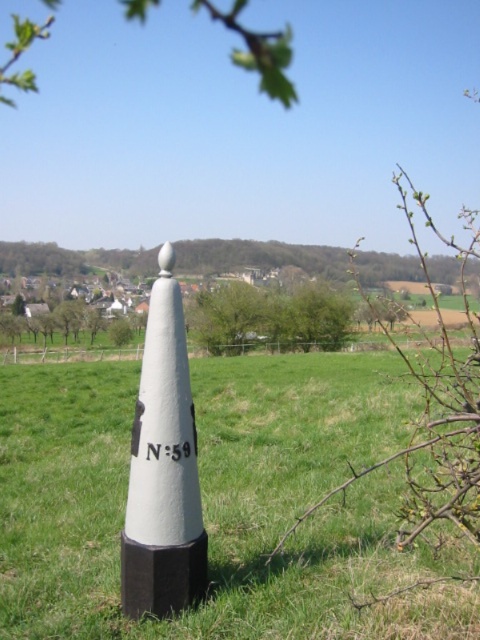
Does white painted concrete cone at center appear on the right side of green leafy branch at upper center?

Yes, white painted concrete cone at center is to the right of green leafy branch at upper center.

Does point (145, 340) lie in front of point (225, 26)?

Yes.

At what (x,y) coordinates should I click in order to perform the action: click on white painted concrete cone at center. Please return your answer as a coordinate pair (x, y). This screenshot has height=640, width=480. Looking at the image, I should click on (163, 468).

Is white matte cone at center bigger than white painted concrete cone at center?

Yes.

What are the coordinates of `white matte cone at center` in the screenshot? It's located at (222, 502).

Who is positioned more to the right, white matte cone at center or green leafy branch at upper center?

white matte cone at center

Can you confirm if white matte cone at center is smaller than green leafy branch at upper center?

→ Yes, white matte cone at center is smaller than green leafy branch at upper center.

I want to click on white matte cone at center, so click(x=222, y=502).